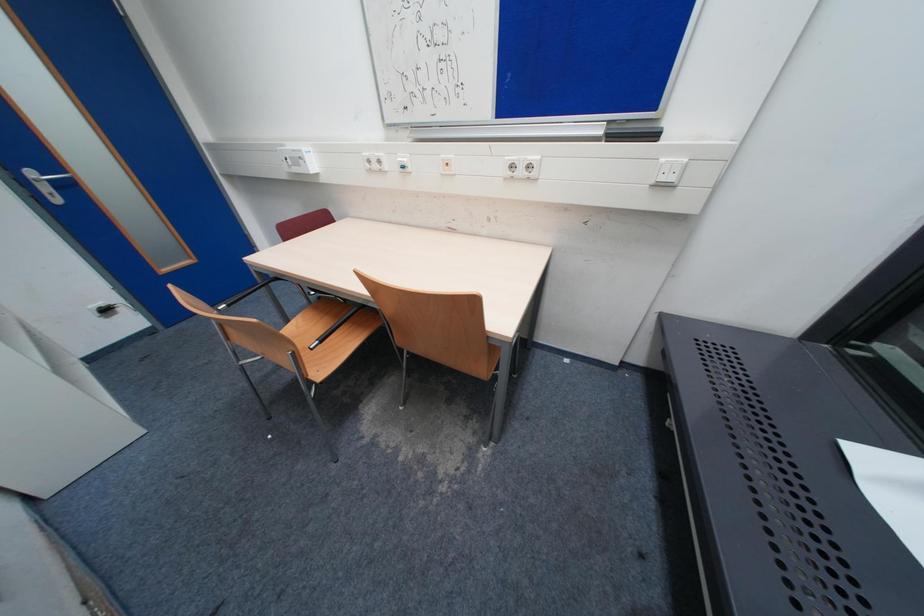
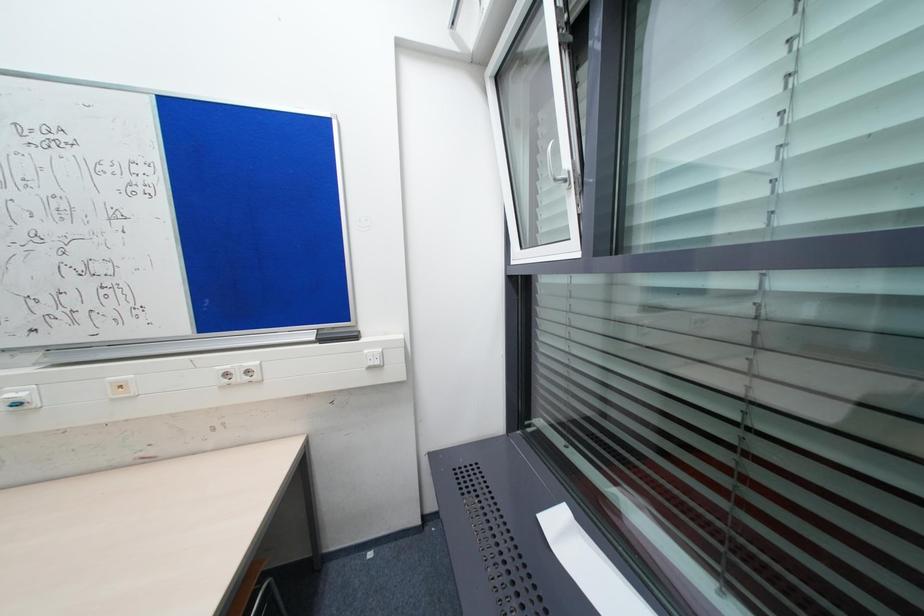
Based on the continuous images, in which direction is the camera rotating?

The camera rotated toward right-up.